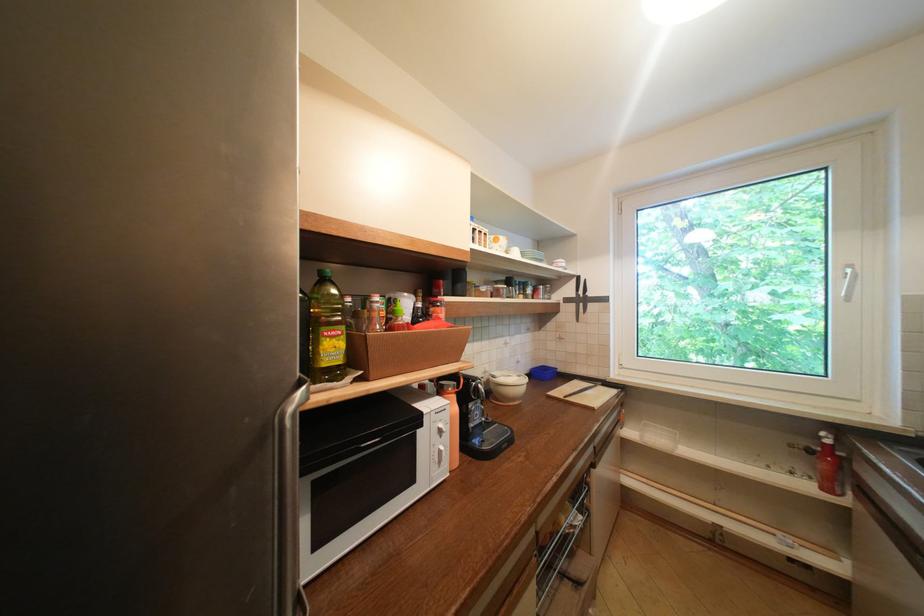
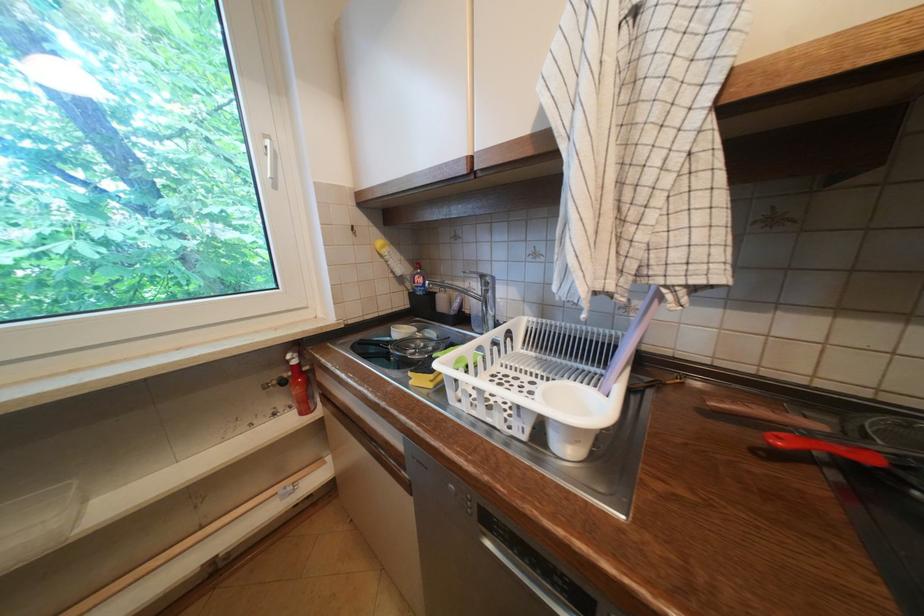
Where in the second image is the point corresponding to pixel 829 439 from the first image?

(296, 362)